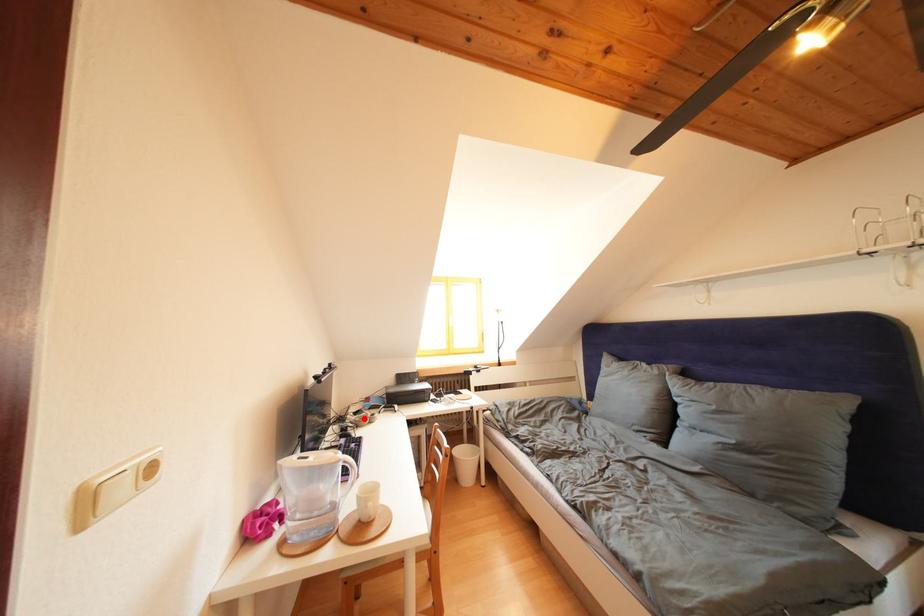
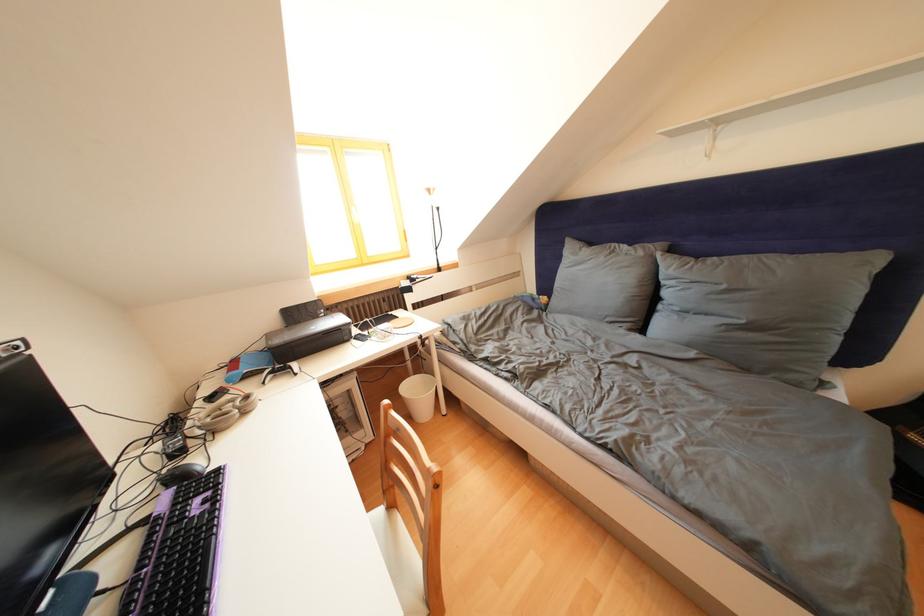
In the second image, find the point that corresponds to the highlighted location in the first image.

(220, 403)